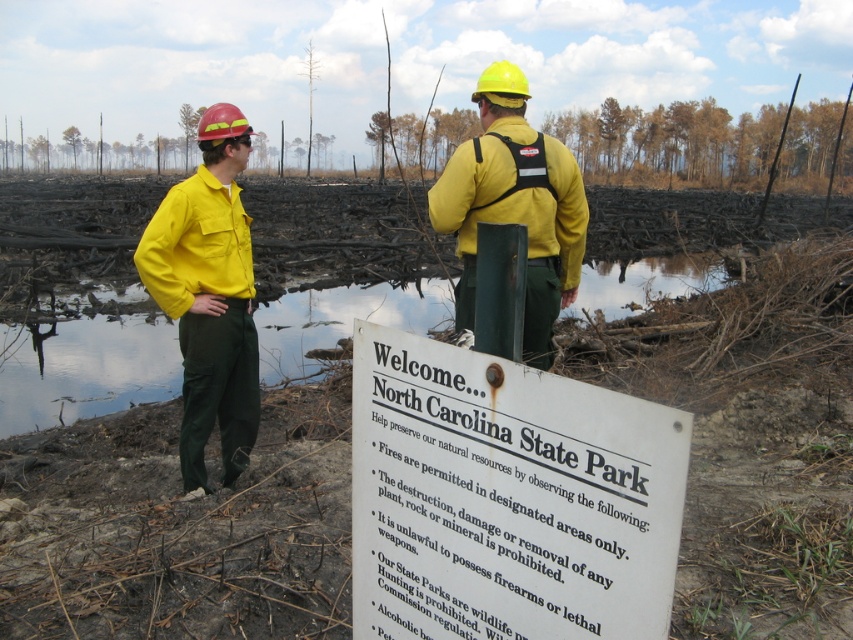
Question: Which point appears farthest from the camera in this image?

Choices:
 (A) (410, 381)
 (B) (170, 388)

Answer: (B)

Question: Based on their relative distances, which object is farther from the yellow matte jacket at left?

Choices:
 (A) clear water at sign center
 (B) reflective yellow safety vest at center
 (C) yellow matte vest at center

Answer: (A)

Question: Is the position of clear water at sign center less distant than that of yellow matte uniform at left?

Choices:
 (A) yes
 (B) no

Answer: (B)

Question: Considering the relative positions of yellow matte vest at center and reflective yellow safety vest at center in the image provided, where is yellow matte vest at center located with respect to reflective yellow safety vest at center?

Choices:
 (A) right
 (B) left

Answer: (B)

Question: Which point is farther from the camera taking this photo?

Choices:
 (A) (471, 211)
 (B) (573, 496)
 (C) (206, 173)
 (D) (231, 435)

Answer: (D)

Question: Is yellow matte uniform at left smaller than yellow matte vest at center?

Choices:
 (A) no
 (B) yes

Answer: (B)